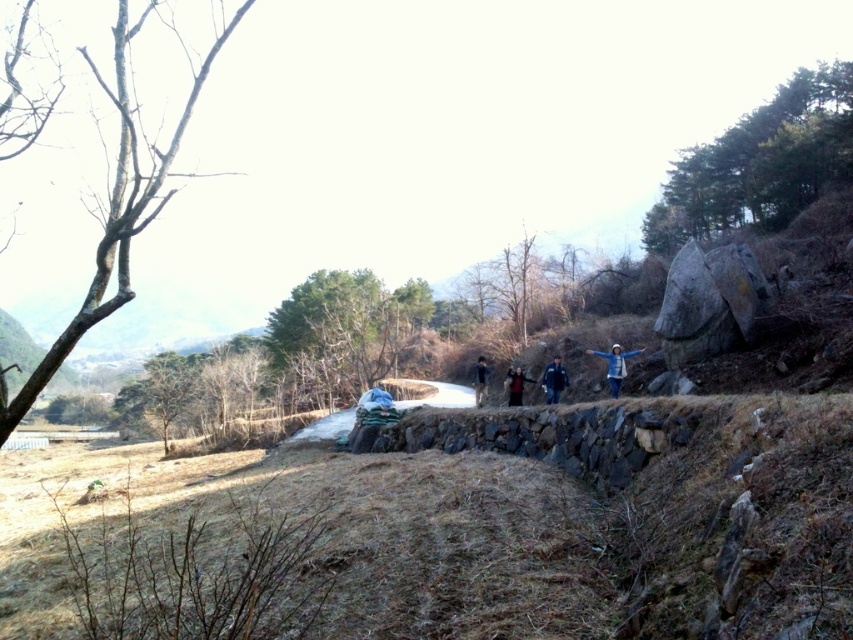
Between point (556, 387) and point (512, 384), which one is positioned in front?

Point (556, 387)

Can you confirm if blue fabric jacket at center is shorter than dark red fabric jacket at center?

Incorrect, blue fabric jacket at center's height does not fall short of dark red fabric jacket at center's.

Describe the element at coordinates (553, 380) in the screenshot. I see `blue fabric jacket at center` at that location.

You are a GUI agent. You are given a task and a screenshot of the screen. Output one action in this format:
    pyautogui.click(x=<x>, y=<y>)
    Task: Click on the blue fabric jacket at center
    
    Given the screenshot: What is the action you would take?
    pyautogui.click(x=553, y=380)

Which of these two, blue fabric person at center-right or blue fabric jacket at center, stands shorter?

blue fabric jacket at center is shorter.

Who is lower down, blue fabric person at center-right or blue fabric jacket at center?

blue fabric jacket at center is lower down.

Find the location of a particular element. Image resolution: width=853 pixels, height=640 pixels. blue fabric person at center-right is located at coordinates (614, 365).

Between dark red fabric jacket at center and dark blue jacket at center, which one appears on the left side from the viewer's perspective?

Positioned to the left is dark blue jacket at center.

Does dark red fabric jacket at center appear on the left side of dark blue jacket at center?

In fact, dark red fabric jacket at center is to the right of dark blue jacket at center.

Between point (529, 378) and point (474, 372), which one is positioned in front?

Point (529, 378) is more forward.

Find the location of `dark red fabric jacket at center`. dark red fabric jacket at center is located at coordinates (515, 385).